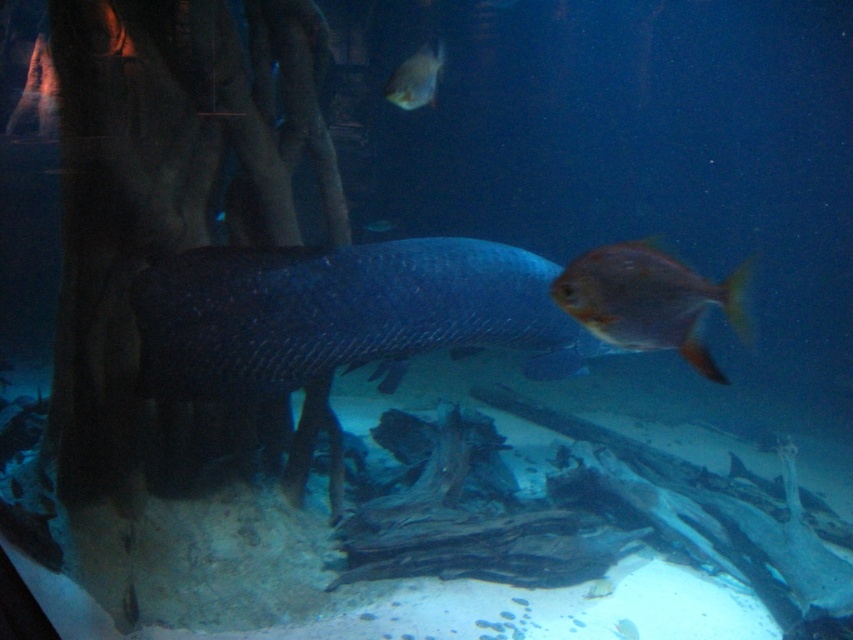
Question: Which point is farther to the camera?

Choices:
 (A) (430, 83)
 (B) (283, 392)
 (C) (646, 243)

Answer: (C)

Question: From the image, what is the correct spatial relationship of shiny orange fish at upper right in relation to shiny silver fish at upper center?

Choices:
 (A) below
 (B) above

Answer: (A)

Question: Is shiny orange fish at upper right positioned at the back of shiny silver fish at upper center?

Choices:
 (A) yes
 (B) no

Answer: (B)

Question: Which object is closer to the camera taking this photo?

Choices:
 (A) shiny silver fish at upper center
 (B) shiny orange fish at upper right

Answer: (B)

Question: Is shiny orange fish at upper right thinner than shiny silver fish at upper center?

Choices:
 (A) yes
 (B) no

Answer: (B)

Question: Which is nearer to the shiny silver fish at upper center?

Choices:
 (A) shiny orange fish at upper right
 (B) shiny blue fish at center

Answer: (B)